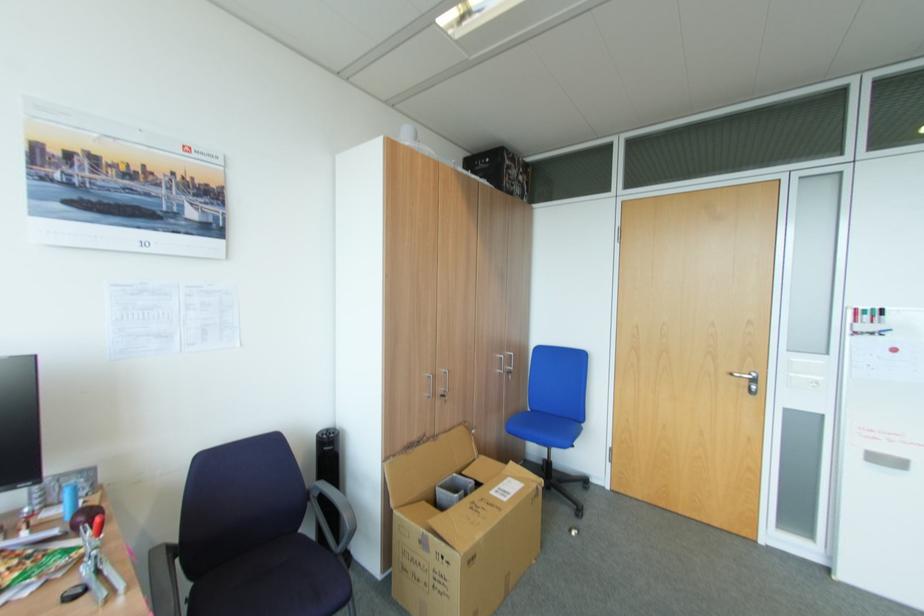
Describe the element at coordinates (749, 381) in the screenshot. The width and height of the screenshot is (924, 616). I see `the metal door handle` at that location.